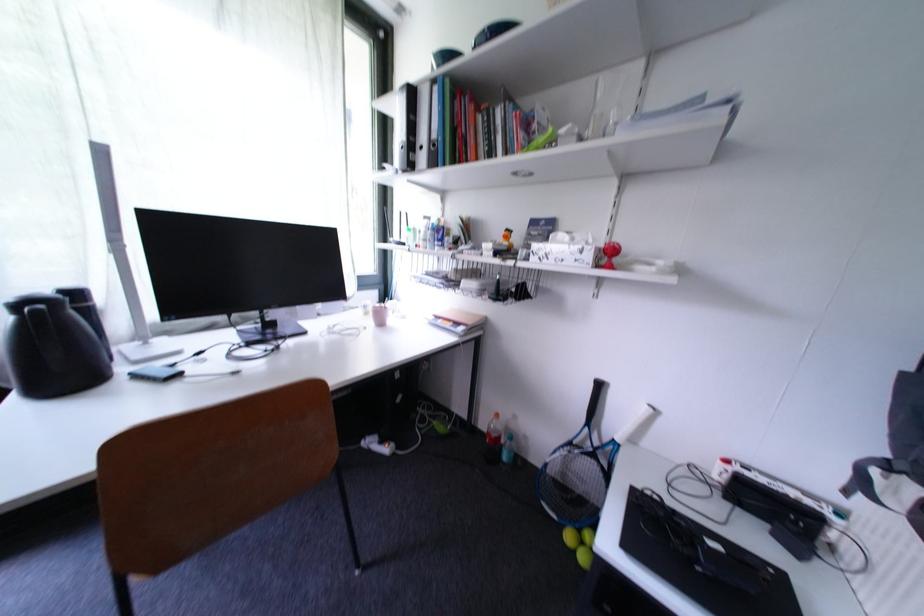
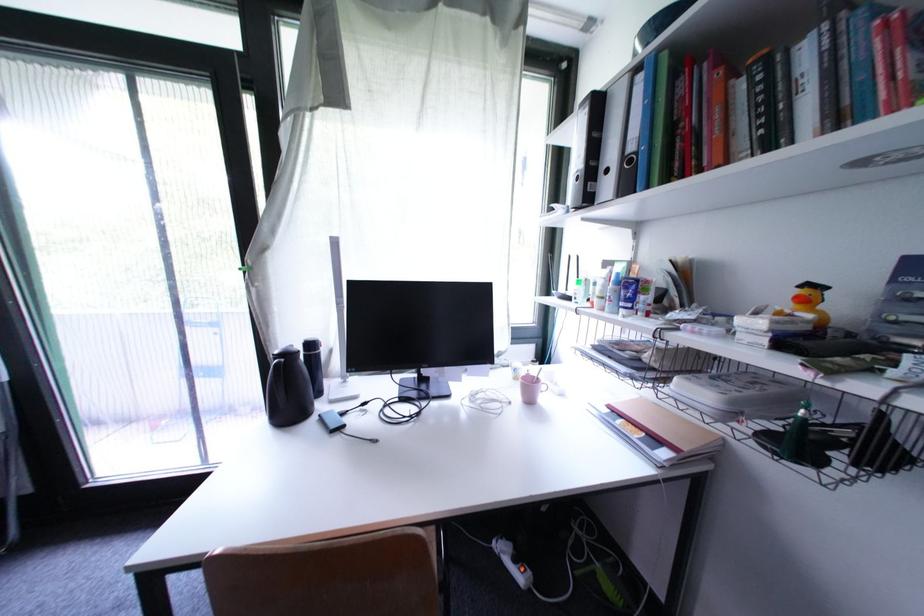
Question: The first image is from the beginning of the video and the second image is from the end. How did the camera likely rotate when shooting the video?

Choices:
 (A) Left
 (B) Right
 (C) Up
 (D) Down

Answer: (A)